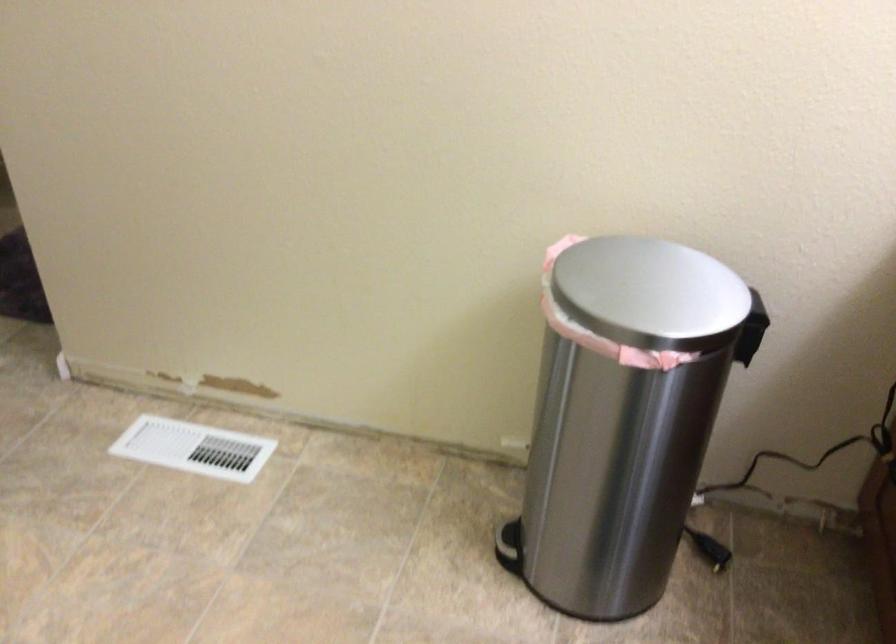
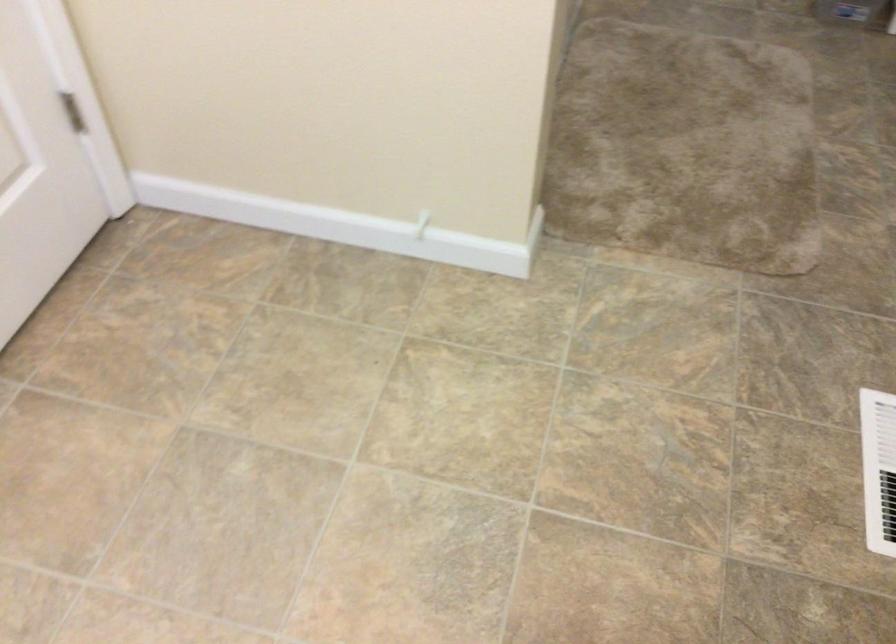
How did the camera likely rotate?

The rotation direction of the camera is left-down.